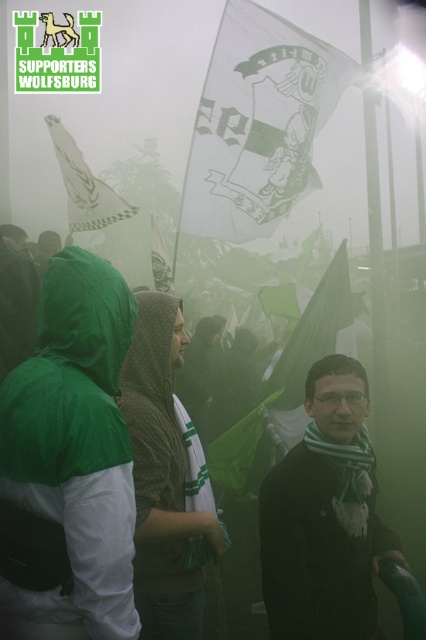
Does green wool scarf at center have a lesser height compared to green fabric jacket at center?

No.

Describe the element at coordinates (325, 516) in the screenshot. I see `green wool scarf at center` at that location.

Locate an element on the screen. Image resolution: width=426 pixels, height=640 pixels. green wool scarf at center is located at coordinates (325, 516).

Who is positioned more to the left, green wool scarf at center or white paper flag at upper left?

Positioned to the left is white paper flag at upper left.

Which is above, green wool scarf at center or white paper flag at upper left?

white paper flag at upper left is above.

Locate an element on the screen. This screenshot has height=640, width=426. green wool scarf at center is located at coordinates [325, 516].

Which is below, green fabric hood at left or green fabric scarf at center?

green fabric scarf at center

How much distance is there between green fabric hood at left and green fabric scarf at center?

green fabric hood at left is 32.06 inches away from green fabric scarf at center.

Which is in front, point (104, 490) or point (137, 518)?

Positioned in front is point (104, 490).

You are a GUI agent. You are given a task and a screenshot of the screen. Output one action in this format:
    pyautogui.click(x=<x>, y=<y>)
    Task: Click on the green fabric hood at left
    The width and height of the screenshot is (426, 640).
    Given the screenshot: What is the action you would take?
    pyautogui.click(x=69, y=464)